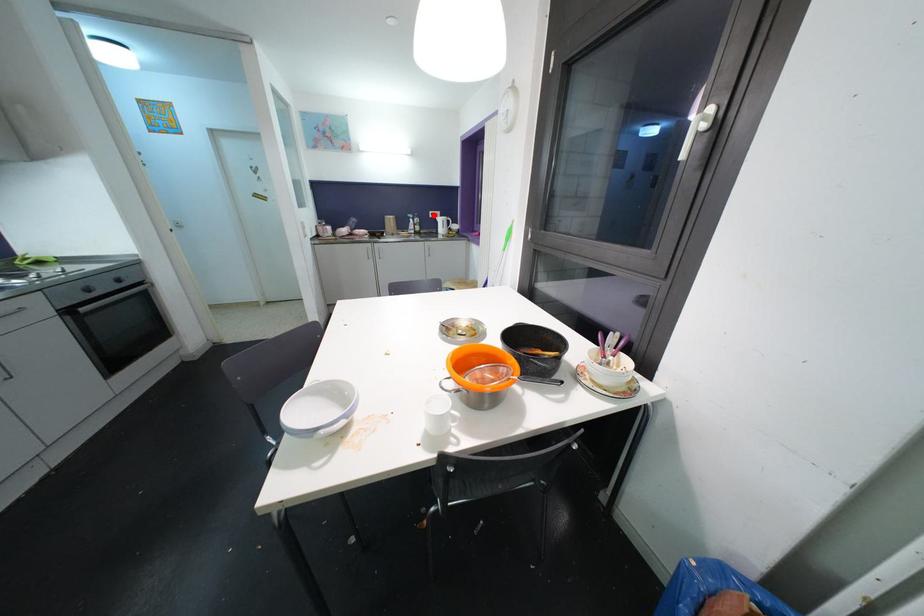
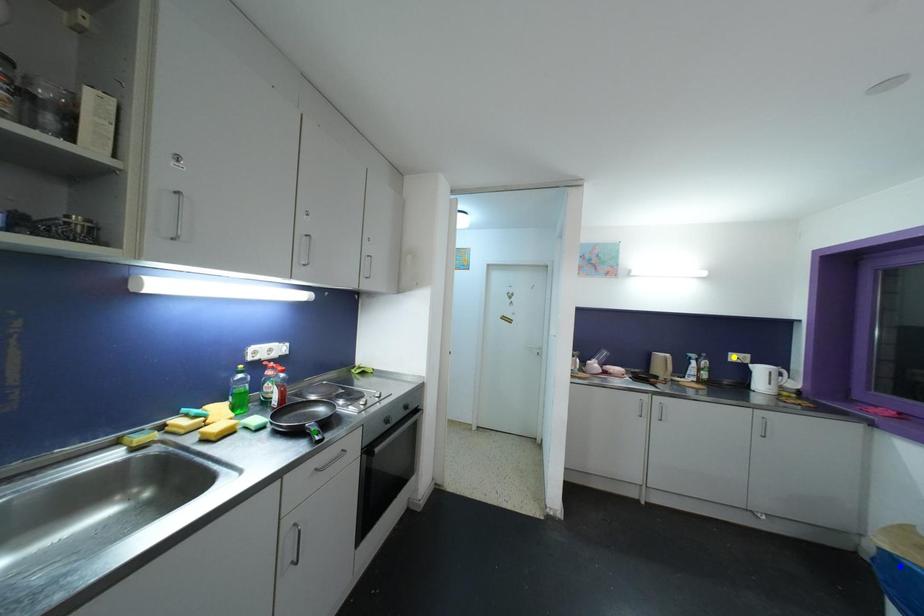
Question: I am providing you with two images of the same scene from different viewpoints. A red point is marked on the first image. You are given multiple points on the second image. Which spot in image 2 lines up with the point in image 1?

Choices:
 (A) blue point
 (B) yellow point
 (C) green point

Answer: (B)